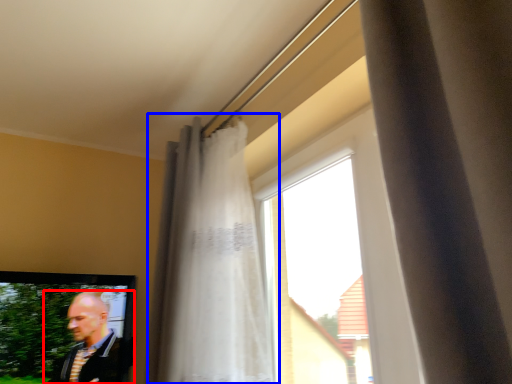
Question: Among these objects, which one is nearest to the camera, man (highlighted by a red box) or curtain (highlighted by a blue box)?

Choices:
 (A) man
 (B) curtain

Answer: (B)